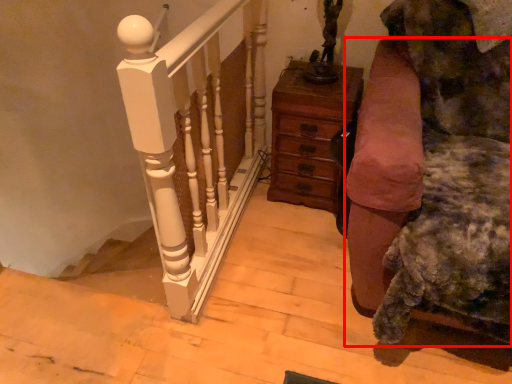
Question: Considering the relative positions of furniture (annotated by the red box) and chest of drawers in the image provided, where is furniture (annotated by the red box) located with respect to the staircase?

Choices:
 (A) left
 (B) right

Answer: (B)